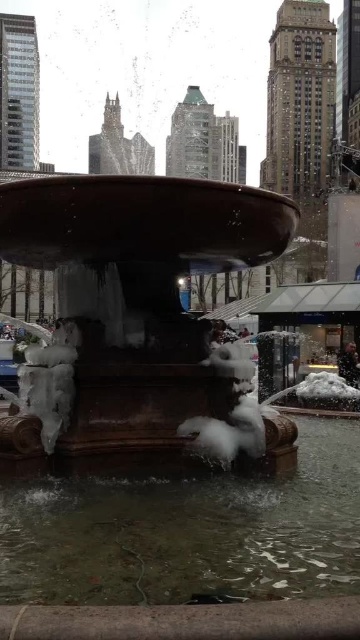
Who is taller, bronze fountain at center or clear water at fountain center?

Standing taller between the two is bronze fountain at center.

Between point (180, 304) and point (82, 541), which one is positioned in front?

Point (82, 541) is more forward.

Where is `bronze fountain at center`? Image resolution: width=360 pixels, height=640 pixels. bronze fountain at center is located at coordinates point(128,310).